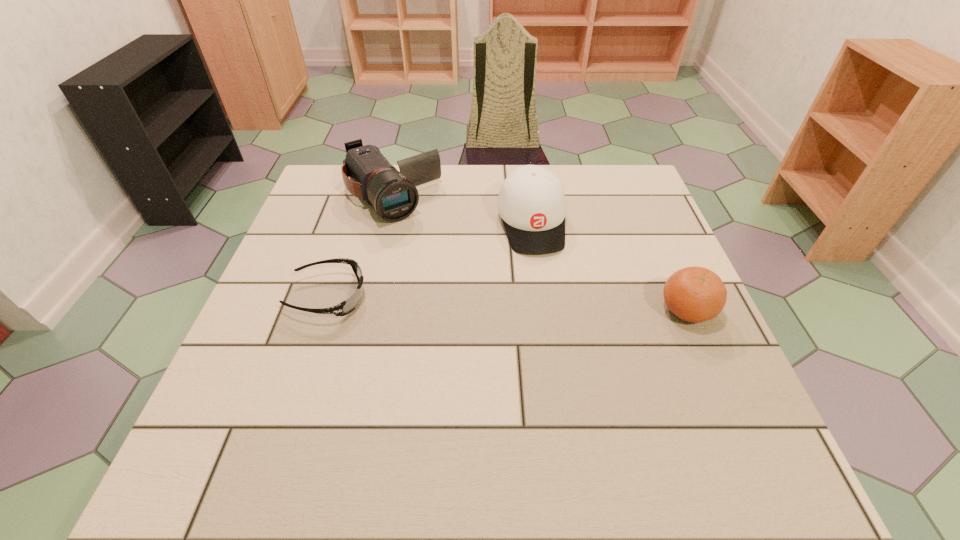
The width and height of the screenshot is (960, 540). Find the location of `blank area at the left edge`. blank area at the left edge is located at coordinates (290, 287).

Find the location of a particular element. The image size is (960, 540). free space at the right edge of the desktop is located at coordinates (642, 234).

This screenshot has height=540, width=960. Identify the location of vacant position at the far left corner of the desktop. (345, 208).

Locate an element on the screen. The height and width of the screenshot is (540, 960). free region at the far right corner is located at coordinates (602, 171).

You are a GUI agent. You are given a task and a screenshot of the screen. Output one action in this format:
    pyautogui.click(x=<x>, y=<y>)
    Task: Click on the vacant region at the near right corner of the desktop
    
    Given the screenshot: What is the action you would take?
    pyautogui.click(x=660, y=422)

Locate an element on the screen. Image resolution: width=960 pixels, height=540 pixels. vacant space in between the second shortest object and the shortest object is located at coordinates (508, 303).

This screenshot has height=540, width=960. I want to click on vacant space that's between the camcorder and the shortest object, so click(360, 246).

In order to click on free spot between the sunglasses and the second shortest object in this screenshot , I will do `click(508, 303)`.

This screenshot has width=960, height=540. Find the location of `free spot between the clementine and the shortest object`. free spot between the clementine and the shortest object is located at coordinates (508, 303).

This screenshot has height=540, width=960. Find the location of `free point between the shortest object and the rightmost object`. free point between the shortest object and the rightmost object is located at coordinates (508, 303).